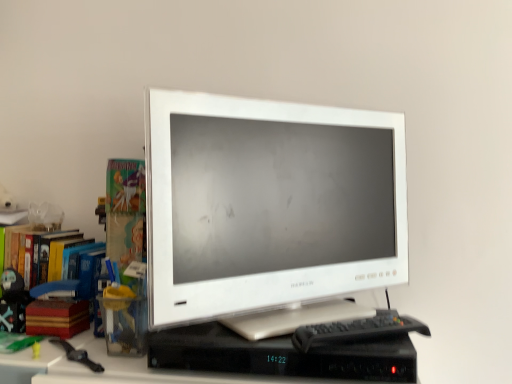
Question: Would you consider matte black figurine at left to be distant from wooden stack of books at left?

Choices:
 (A) yes
 (B) no

Answer: (B)

Question: Are matte black figurine at left and wooden stack of books at left beside each other?

Choices:
 (A) no
 (B) yes

Answer: (B)

Question: Is matte black figurine at left facing away from wooden stack of books at left?

Choices:
 (A) no
 (B) yes

Answer: (A)

Question: Is matte black figurine at left to the right of wooden stack of books at left from the viewer's perspective?

Choices:
 (A) yes
 (B) no

Answer: (B)

Question: Considering the relative sizes of matte black figurine at left and wooden stack of books at left in the image provided, is matte black figurine at left thinner than wooden stack of books at left?

Choices:
 (A) no
 (B) yes

Answer: (B)

Question: Is multicolored cardboard books at left bigger or smaller than black plastic computer desk at center?

Choices:
 (A) small
 (B) big

Answer: (B)

Question: Considering their positions, is multicolored cardboard books at left located in front of or behind black plastic computer desk at center?

Choices:
 (A) front
 (B) behind

Answer: (B)

Question: In the image, is multicolored cardboard books at left on the left side or the right side of black plastic computer desk at center?

Choices:
 (A) left
 (B) right

Answer: (A)

Question: Does point (28, 228) appear closer or farther from the camera than point (181, 380)?

Choices:
 (A) closer
 (B) farther

Answer: (B)

Question: From the image's perspective, relative to wooden stack of books at left, is white glossy monitor at center above or below?

Choices:
 (A) above
 (B) below

Answer: (A)

Question: Considering the positions of white glossy monitor at center and wooden stack of books at left in the image, is white glossy monitor at center wider or thinner than wooden stack of books at left?

Choices:
 (A) thin
 (B) wide

Answer: (B)

Question: From a real-world perspective, relative to wooden stack of books at left, is white glossy monitor at center vertically above or below?

Choices:
 (A) above
 (B) below

Answer: (A)

Question: Looking at the image, does white glossy monitor at center seem bigger or smaller compared to wooden stack of books at left?

Choices:
 (A) small
 (B) big

Answer: (B)

Question: In the image, is wooden stack of books at left positioned in front of or behind white glossy monitor at center?

Choices:
 (A) front
 (B) behind

Answer: (B)

Question: Looking at their shapes, would you say wooden stack of books at left is wider or thinner than white glossy monitor at center?

Choices:
 (A) wide
 (B) thin

Answer: (B)